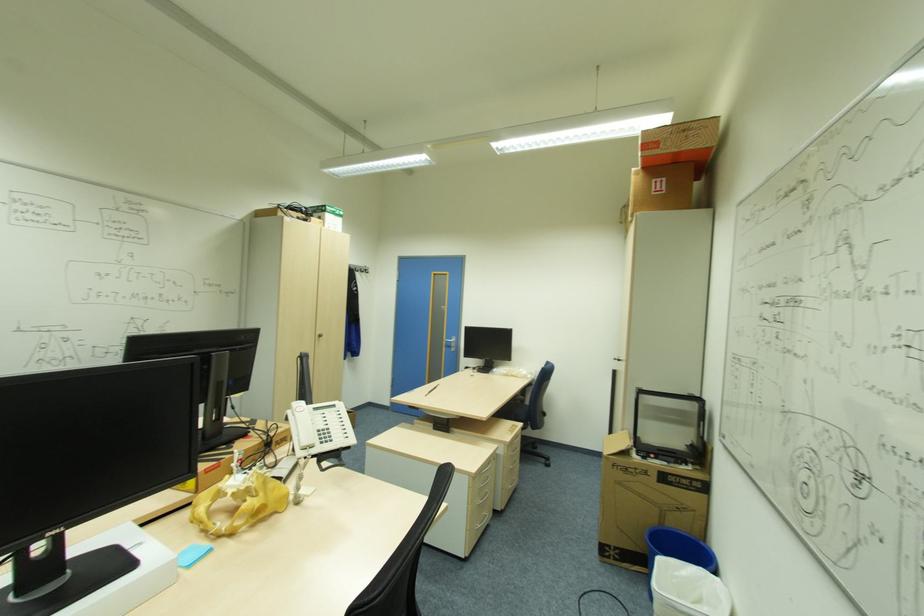
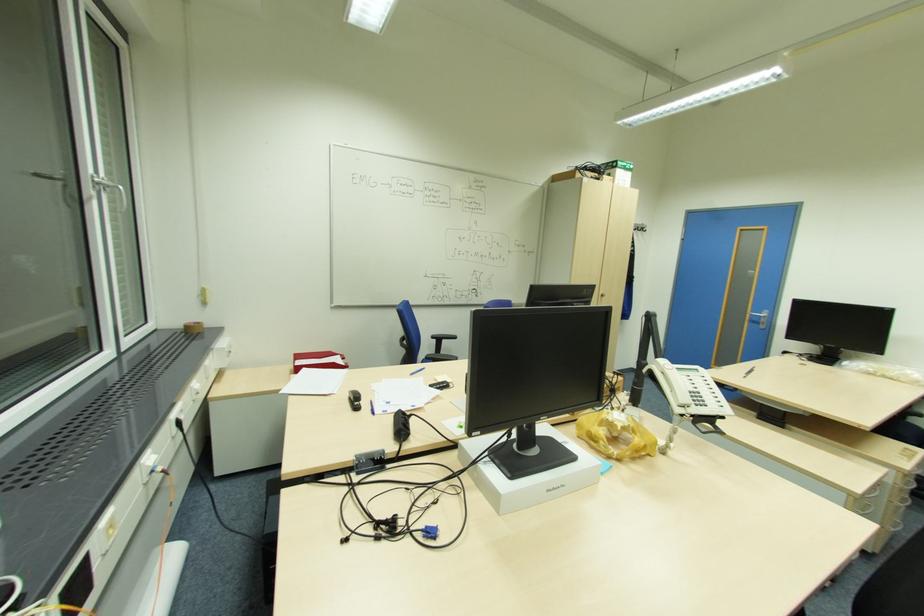
The point at (235, 533) is marked in the first image. Where is the corresponding point in the second image?

(621, 459)